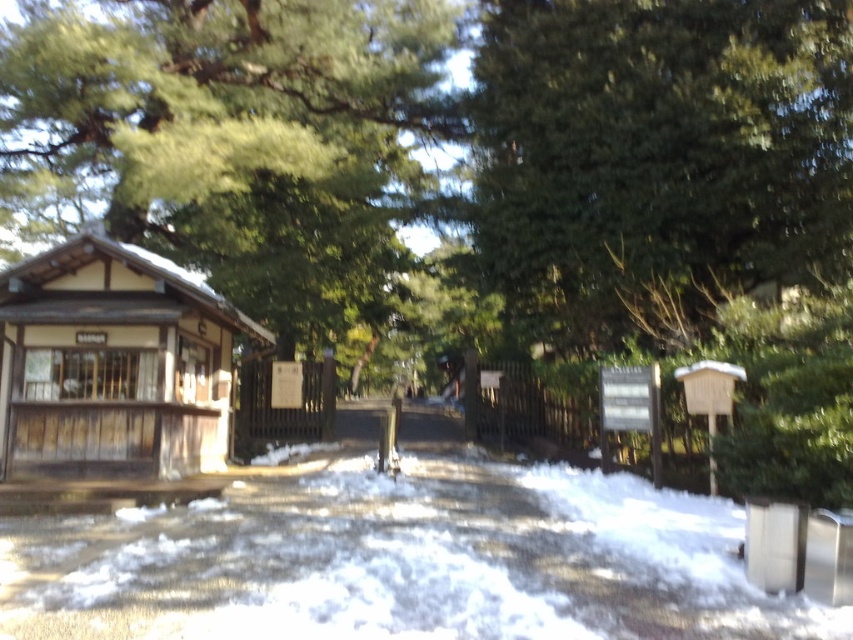
You are planning to build a small garden between the white fluffy snow at center and the brown wooden hut at left. Based on the scene description, which object has a smaller width and thus might require less space for the garden?

The white fluffy snow at center has a smaller width than the brown wooden hut at left, so it might require less space for the garden.

You are a visitor at the park and want to take a photo of the brown wooden hut at left. However, there is white fluffy snow at center blocking your view. Can you move to the side to get a clear shot without the snow in the frame?

The white fluffy snow at center is in front of the brown wooden hut at left, so moving to the side might help you position yourself where the snow is no longer blocking the view of the hut.

You are planning to build a snowman using the white fluffy snow at center near the brown wooden hut at left. Can you estimate if there is enough snow available based on their sizes?

The white fluffy snow at center occupies less space than brown wooden hut at left, so there might not be enough snow to build a snowman of the same size as the brown wooden hut at left.